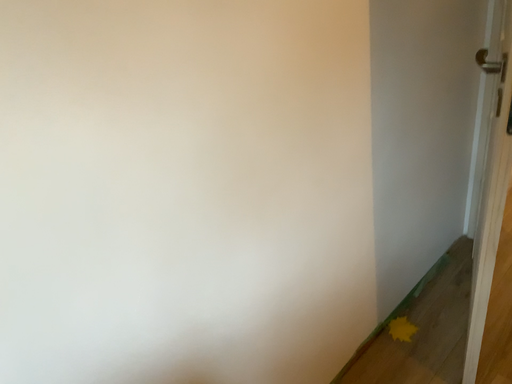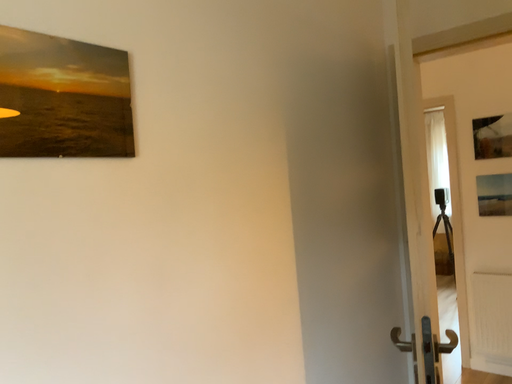
Question: Which way did the camera rotate in the video?

Choices:
 (A) rotated downward
 (B) rotated upward

Answer: (B)